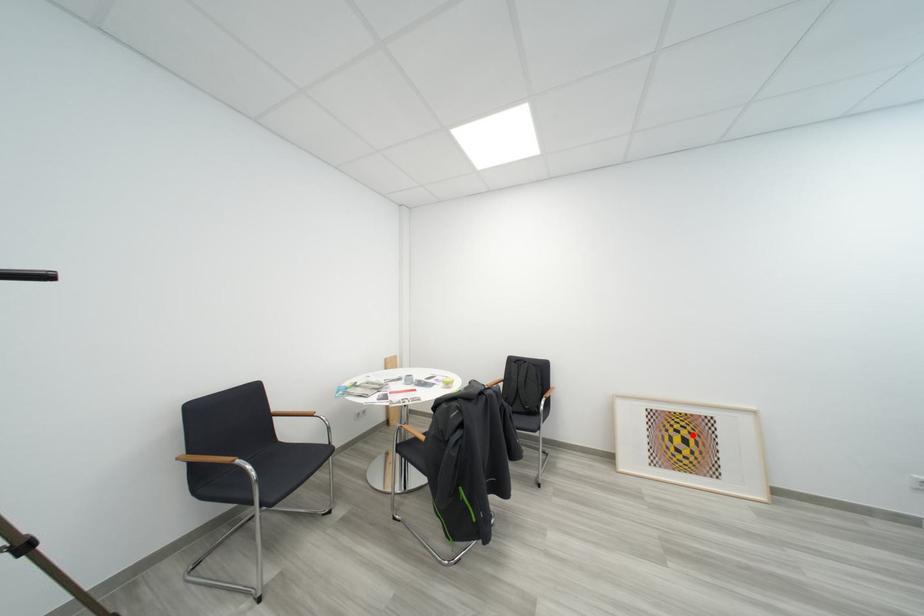
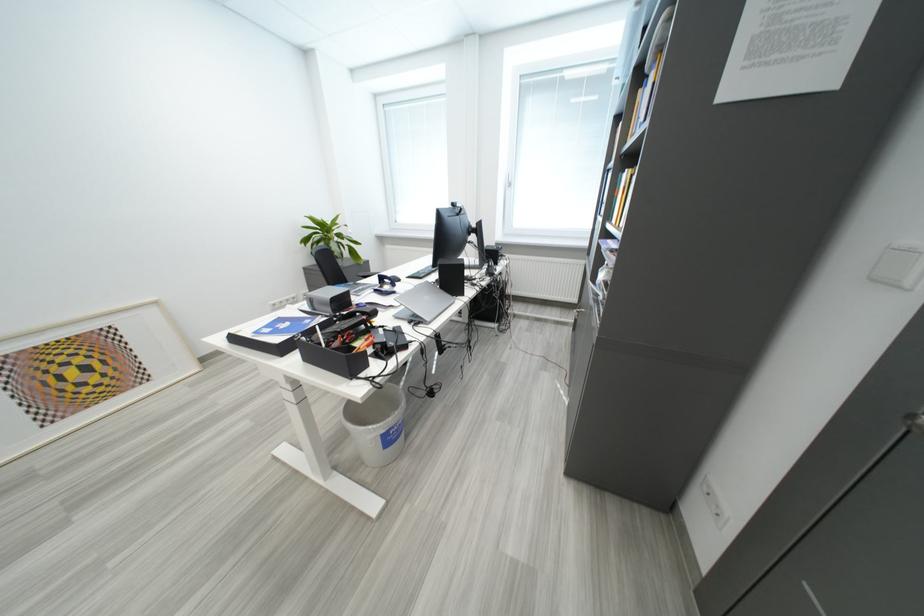
In the second image, find the point that corresponds to the highlighted location in the first image.

(88, 363)